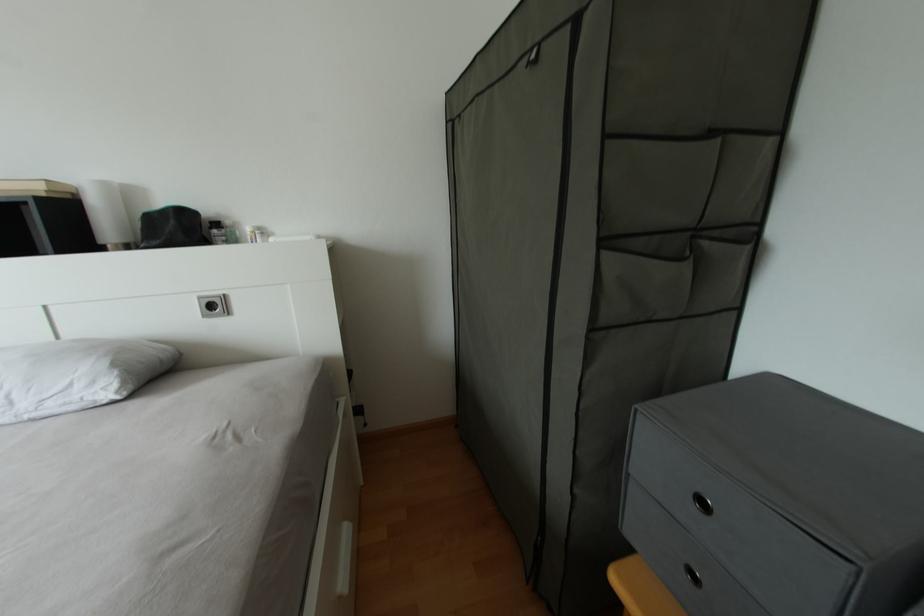
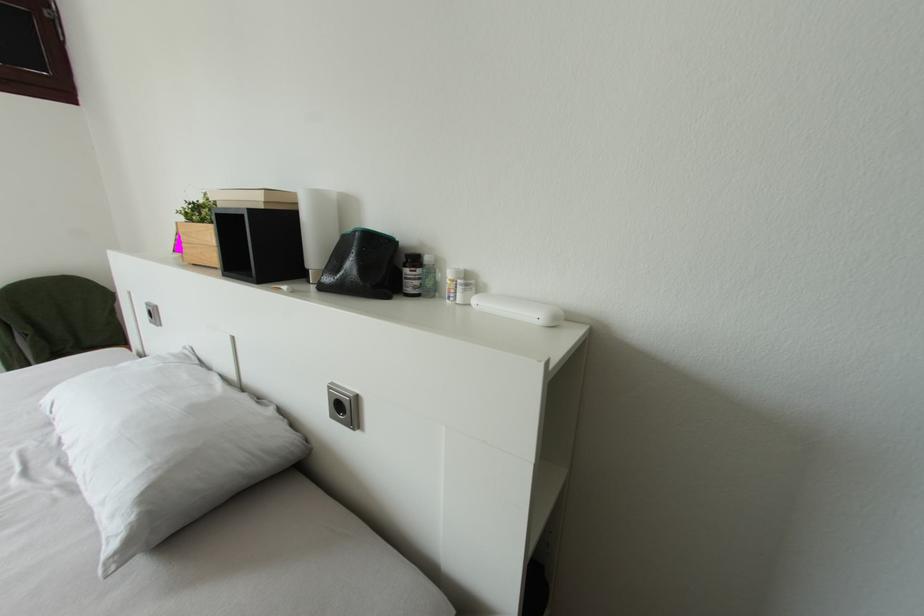
Question: How did the camera likely rotate?

Choices:
 (A) Left
 (B) Right
 (C) Up
 (D) Down

Answer: (A)